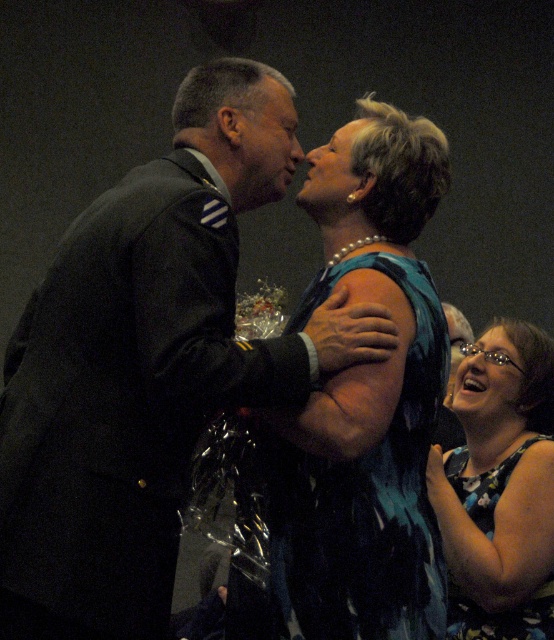
You are an event photographer at this formal event. You need to capture a photo of both the blue satin dress at center and the matte black face at center in the same frame. Based on their positions, which one should you focus on first to ensure both are in focus?

The blue satin dress at center is located below matte black face at center. To ensure both are in focus, you should focus on the matte black face at center first since it is closer to the camera, allowing the dress below it to also be in focus within the depth of field.

You are a photographer at the event and want to capture a closeup of the floral dress at lower right without the glossy black hair at lower right appearing in the background. Is this possible based on their positions?

Yes, since the floral dress at lower right is in front of the glossy black hair at lower right, the photographer can focus on the floral dress at lower right and avoid including the glossy black hair at lower right in the background.